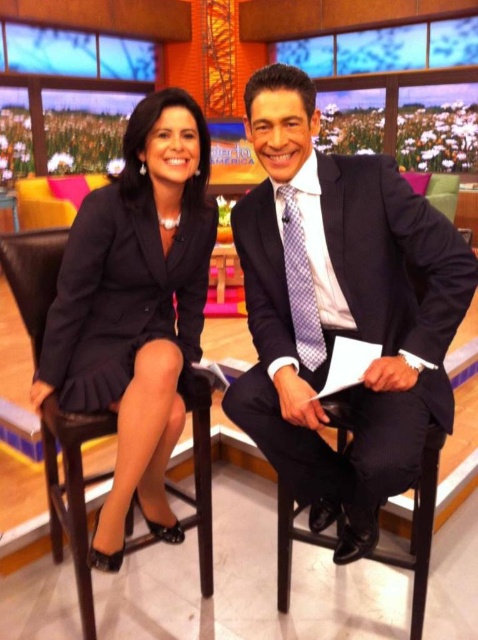
What is the color of the dress at the point specified by coordinates [136,307]?

The point at coordinates [136,307] is on the matte black dress at left.